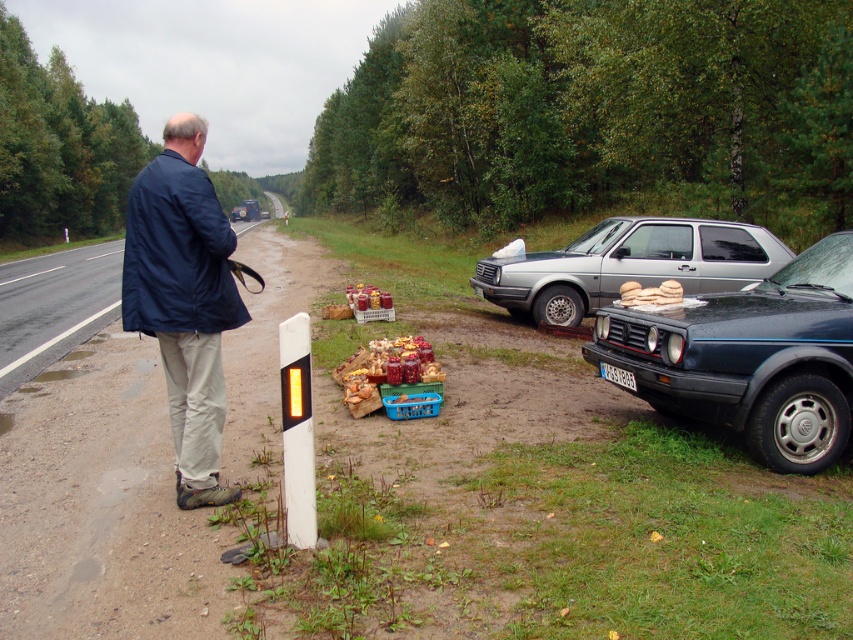
Question: Does dark blue fabric jacket at left have a lesser width compared to shiny plastic jars at center?

Choices:
 (A) yes
 (B) no

Answer: (A)

Question: Considering the relative positions of dark blue fabric jacket at left and black plastic license plate at lower center in the image provided, where is dark blue fabric jacket at left located with respect to black plastic license plate at lower center?

Choices:
 (A) right
 (B) left

Answer: (B)

Question: Can you confirm if shiny dark blue car at right is positioned below silver metallic car at right?

Choices:
 (A) no
 (B) yes

Answer: (B)

Question: Which object is positioned closest to the black plastic license plate at lower center?

Choices:
 (A) shiny dark blue car at right
 (B) silver metallic car at right
 (C) white fluffy bread at center
 (D) shiny metallic jars at center

Answer: (C)

Question: Which point is closer to the camera taking this photo?

Choices:
 (A) (675, 291)
 (B) (698, 298)
 (C) (779, 250)
 (D) (349, 404)

Answer: (A)

Question: Which object is the closest to the shiny metallic jars at center?

Choices:
 (A) shiny plastic jars at center
 (B) shiny dark blue car at right
 (C) white fluffy bread at center

Answer: (A)